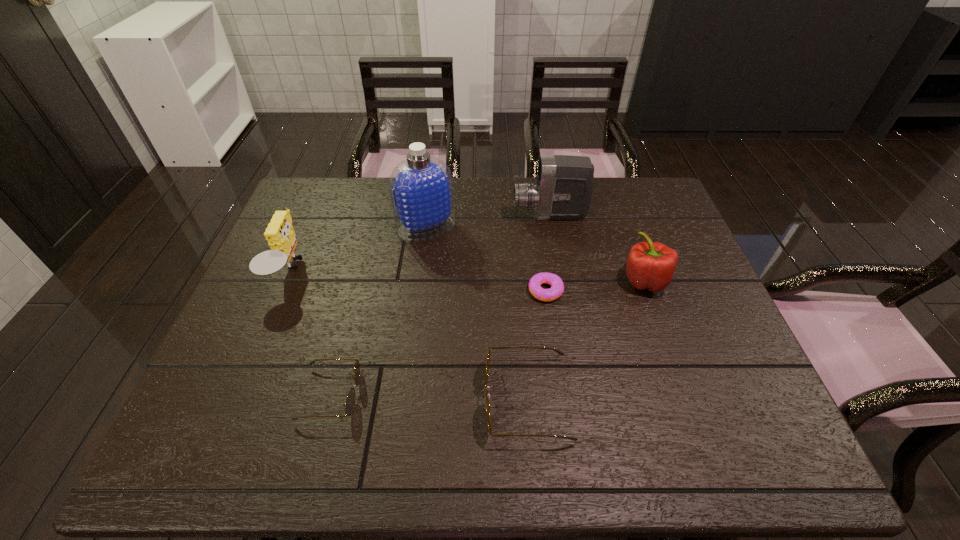
What are the coordinates of `vacant area that lies between the second shortest object and the rightmost object` in the screenshot? It's located at (488, 337).

Where is `free spot between the bell pepper and the second object from left to right`? This screenshot has width=960, height=540. free spot between the bell pepper and the second object from left to right is located at coordinates (488, 337).

The image size is (960, 540). Identify the location of vacant area that lies between the shortest object and the sponge. pyautogui.click(x=418, y=281).

Identify the location of free area in between the cleansing agent and the doughnut. (486, 259).

Where is `vacant space in between the doughnut and the sixth object from right to left`? The image size is (960, 540). vacant space in between the doughnut and the sixth object from right to left is located at coordinates (438, 342).

This screenshot has width=960, height=540. In order to click on unoccupied position between the camcorder and the rightmost object in this screenshot , I will do `click(597, 248)`.

The width and height of the screenshot is (960, 540). Identify the location of free space that is in between the doughnut and the bell pepper. (595, 286).

This screenshot has width=960, height=540. Identify the location of free point between the third object from left to right and the bell pepper. (536, 254).

This screenshot has height=540, width=960. I want to click on unoccupied area between the sponge and the fourth shortest object, so click(467, 276).

Locate an element on the screen. The image size is (960, 540). free space between the tallest object and the sixth tallest object is located at coordinates (378, 311).